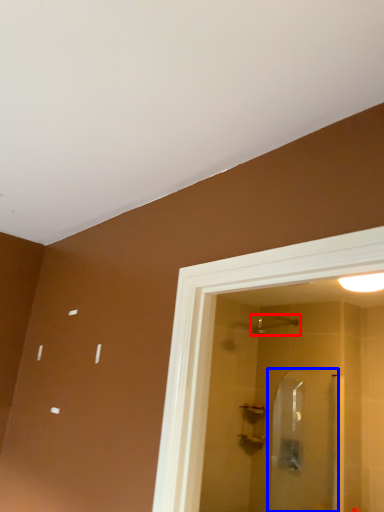
Question: Among these objects, which one is nearest to the camera, shower (highlighted by a red box) or screen door (highlighted by a blue box)?

Choices:
 (A) shower
 (B) screen door

Answer: (B)